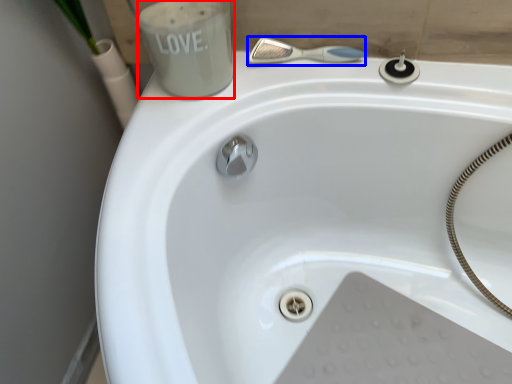
Question: Which point is closer to the camera, liquid (highlighted by a red box) or shower (highlighted by a blue box)?

Choices:
 (A) liquid
 (B) shower

Answer: (A)